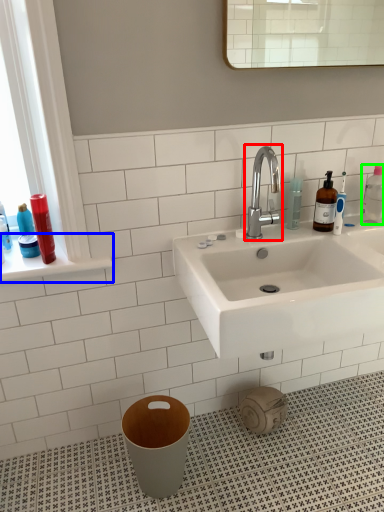
Question: Which object is the closest to the tap (highlighted by a red box)? Choose among these: window sill (highlighted by a blue box) or cleaning product (highlighted by a green box).

Choices:
 (A) window sill
 (B) cleaning product

Answer: (B)